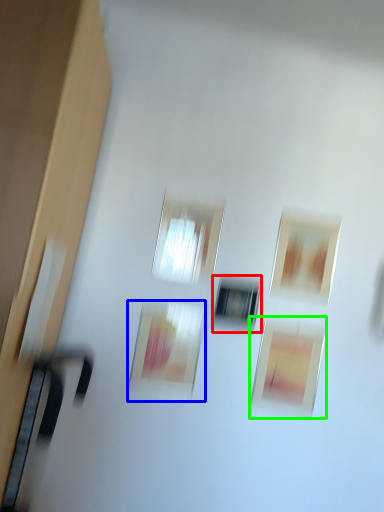
Question: Which object is positioned closest to window (highlighted by a red box)? Select from picture frame (highlighted by a blue box) and picture frame (highlighted by a green box).

Choices:
 (A) picture frame
 (B) picture frame

Answer: (A)